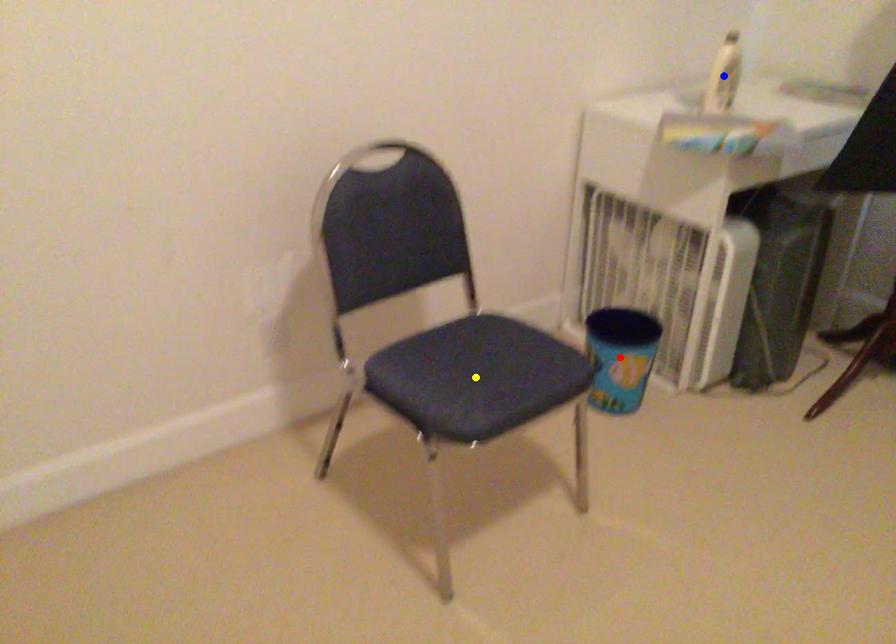
Order these from nearest to farthest:
- blue point
- yellow point
- red point

1. red point
2. blue point
3. yellow point